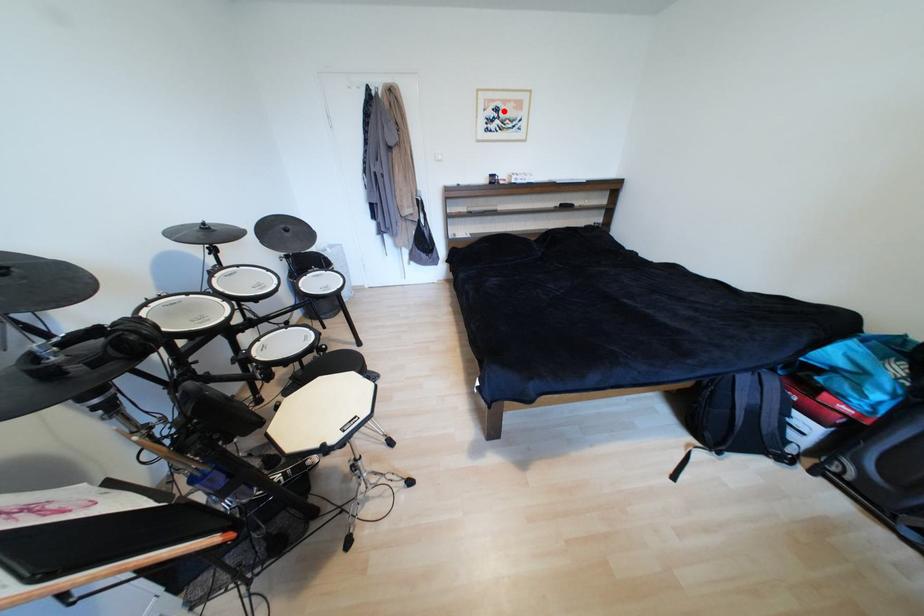
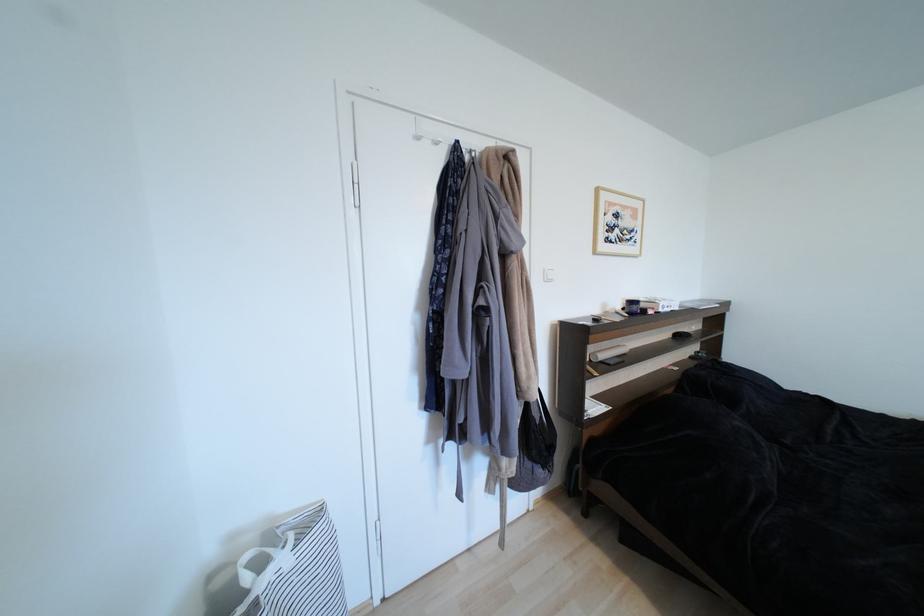
Locate, in the second image, the point that corresponds to the highlighted location in the first image.

(623, 217)